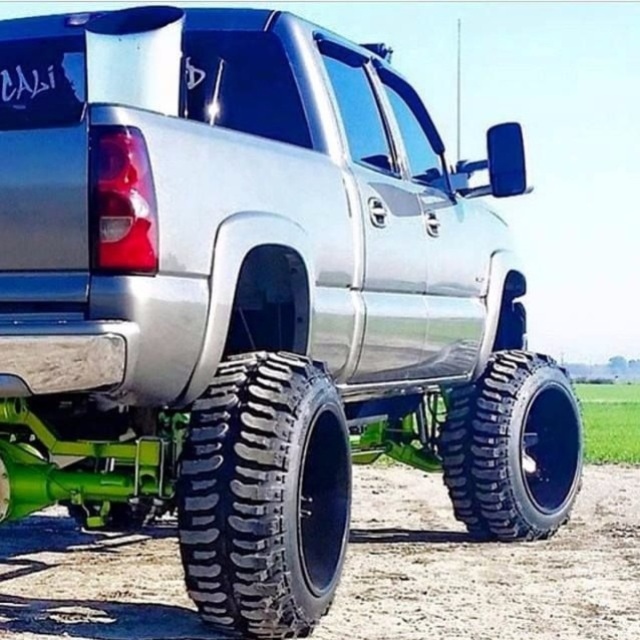
You are a photographer planning to take a closeup shot of the black rubber tire at lower right and the black matte license plate at rear. Which object should you focus on first if you want to capture both in one frame without moving the camera?

The black rubber tire at lower right is larger in size than the black matte license plate at rear, so you should focus on the black rubber tire at lower right first to ensure it fills the frame appropriately before adjusting for the smaller license plate.